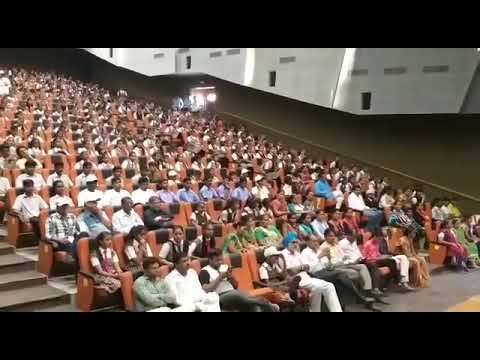
Locate an element on the screen. This screenshot has height=360, width=480. stairs is located at coordinates (14, 268).